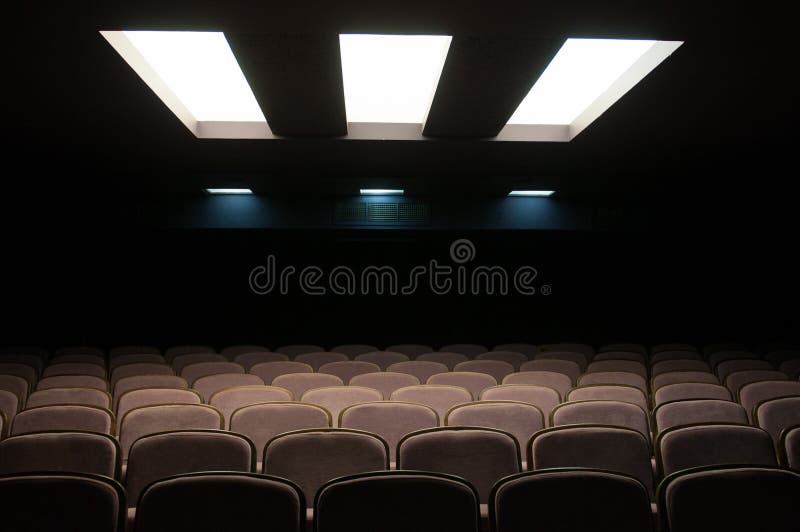
You are a GUI agent. You are given a task and a screenshot of the screen. Output one action in this format:
    pyautogui.click(x=<x>, y=<y>)
    Task: Click on the lights
    The width and height of the screenshot is (800, 532).
    Given the screenshot: What is the action you would take?
    pyautogui.click(x=214, y=64), pyautogui.click(x=356, y=69), pyautogui.click(x=560, y=81), pyautogui.click(x=538, y=201), pyautogui.click(x=390, y=203), pyautogui.click(x=262, y=206)